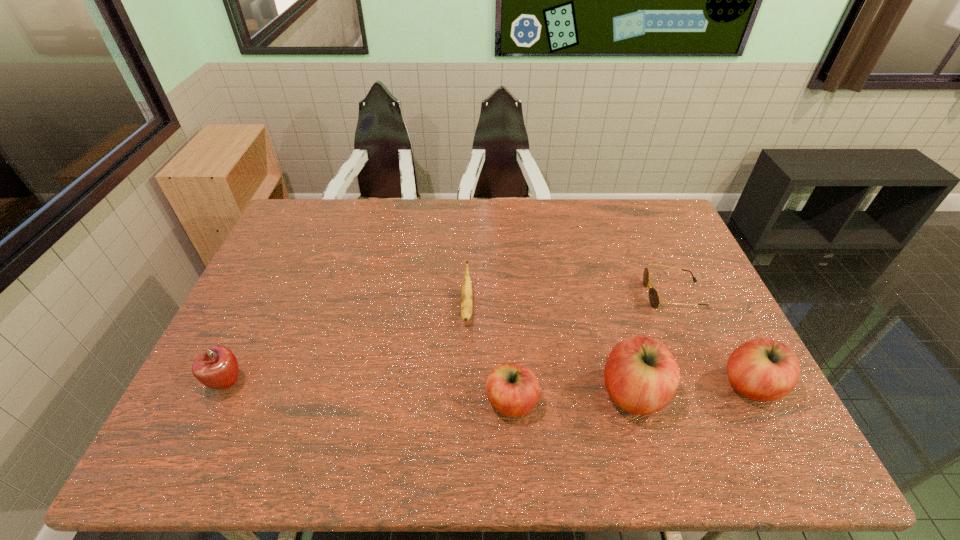
Locate an element on the screen. This screenshot has width=960, height=540. the third object from left to right is located at coordinates (513, 390).

Locate an element on the screen. This screenshot has height=540, width=960. the third object from right to left is located at coordinates (641, 375).

The image size is (960, 540). Identify the location of the rightmost apple. (763, 369).

Find the location of `the second tallest object`. the second tallest object is located at coordinates (763, 369).

You are a GUI agent. You are given a task and a screenshot of the screen. Output one action in this format:
    pyautogui.click(x=<x>, y=<y>)
    Task: Click on the banana
    
    Given the screenshot: What is the action you would take?
    pyautogui.click(x=466, y=299)

Where is `the second object from left to right`? Image resolution: width=960 pixels, height=540 pixels. the second object from left to right is located at coordinates (466, 299).

Where is `sunglasses`? The image size is (960, 540). sunglasses is located at coordinates (654, 298).

Where is `the leftmost apple`? This screenshot has height=540, width=960. the leftmost apple is located at coordinates pyautogui.click(x=217, y=367).

Identify the location of vacant point located 0.130m on the back of the second apple from left to right. (508, 339).

At what (x,y) coordinates should I click in order to perform the action: click on free region located 0.140m on the right of the third apple from left to right. Please return your answer as a coordinate pair (x, y). This screenshot has width=960, height=540. Looking at the image, I should click on coord(725,393).